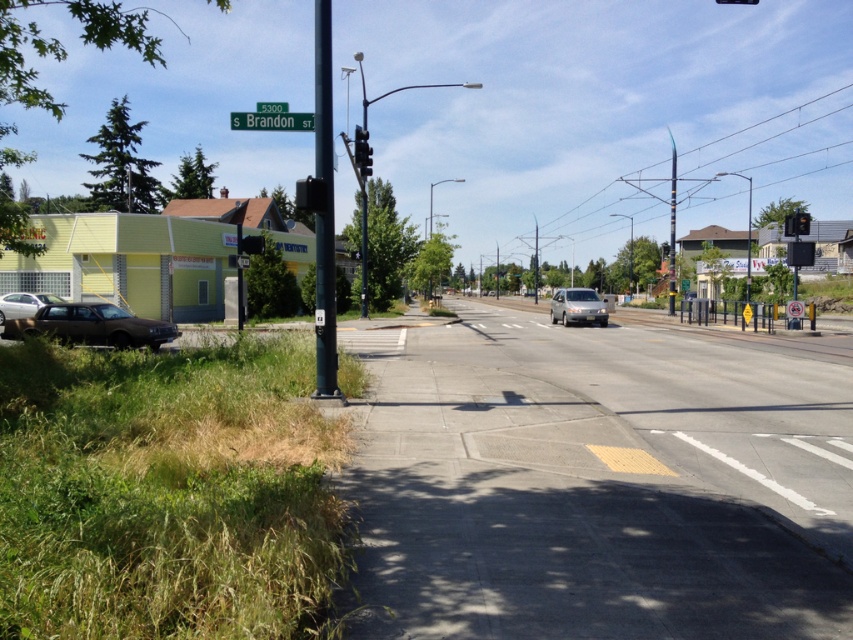
Can you confirm if metallic pole at center is wider than red glass traffic light at upper right?

Indeed, metallic pole at center has a greater width compared to red glass traffic light at upper right.

Can you confirm if metallic pole at center is shorter than red glass traffic light at upper right?

No.

The width and height of the screenshot is (853, 640). Describe the element at coordinates (363, 252) in the screenshot. I see `metallic pole at center` at that location.

The height and width of the screenshot is (640, 853). In order to click on metallic pole at center in this screenshot , I will do `click(363, 252)`.

What are the coordinates of `black plastic traffic light at upper right` in the screenshot? It's located at (799, 253).

Is black plastic traffic light at upper right bigger than metallic traffic light at center?

Incorrect, black plastic traffic light at upper right is not larger than metallic traffic light at center.

Find the location of a particular element. Image resolution: width=853 pixels, height=640 pixels. black plastic traffic light at upper right is located at coordinates (799, 253).

Find the location of a particular element. Image resolution: width=853 pixels, height=640 pixels. black plastic traffic light at upper right is located at coordinates (799, 253).

Who is shorter, metallic pole at upper right or metallic rectangular traffic light at right?

With less height is metallic rectangular traffic light at right.

Can you confirm if metallic pole at upper right is wider than metallic rectangular traffic light at right?

Yes.

What are the coordinates of `metallic pole at upper right` in the screenshot? It's located at (672, 228).